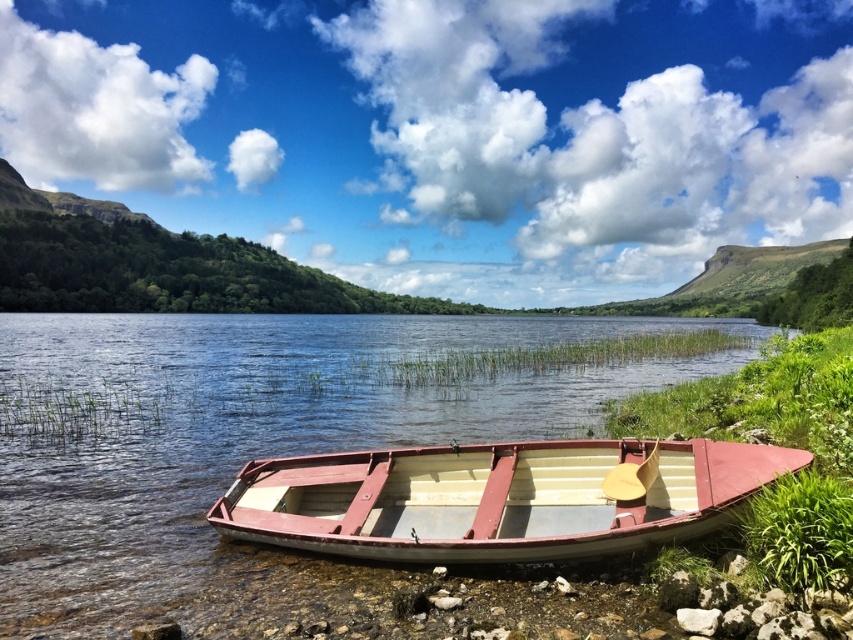
Is point (155, 426) positioned in front of point (693, 445)?

No, (155, 426) is behind (693, 445).

Is point (547, 394) farther from camera compared to point (668, 502)?

That is True.

You are a GUI agent. You are given a task and a screenshot of the screen. Output one action in this format:
    pyautogui.click(x=<x>, y=<y>)
    Task: Click on the white glossy water at center
    This screenshot has width=853, height=640.
    Given the screenshot: What is the action you would take?
    pyautogui.click(x=247, y=445)